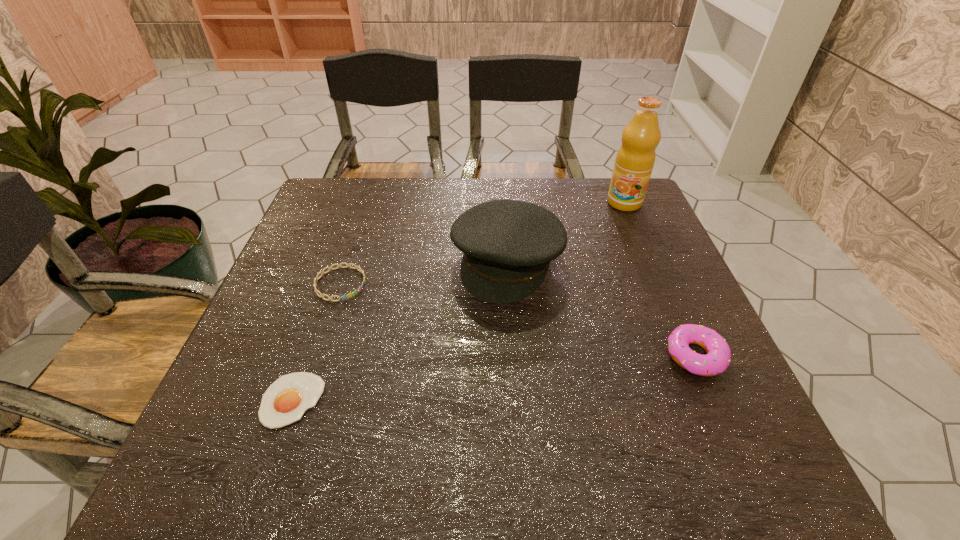
This screenshot has width=960, height=540. In order to click on vacant space at the far right corner of the desktop in this screenshot , I will do `click(606, 217)`.

Image resolution: width=960 pixels, height=540 pixels. Find the location of `free spot between the beret and the shortest object`. free spot between the beret and the shortest object is located at coordinates (399, 331).

Locate an element on the screen. The image size is (960, 540). blank region between the shortest object and the third tallest object is located at coordinates (493, 378).

Where is `free space between the second tallest object and the shortest object`? free space between the second tallest object and the shortest object is located at coordinates (399, 331).

Where is `free spot between the third tallest object and the shortest object`? This screenshot has width=960, height=540. free spot between the third tallest object and the shortest object is located at coordinates (493, 378).

Locate an element on the screen. free area in between the fruit juice and the shortest object is located at coordinates (458, 301).

Where is `free space between the shortest object and the second shortest object`? This screenshot has height=540, width=960. free space between the shortest object and the second shortest object is located at coordinates (316, 342).

I want to click on free space between the shortest object and the tallest object, so click(458, 301).

Identify the location of empty space that is in between the egg yolk and the third object from right to left. (399, 331).

The image size is (960, 540). In order to click on free point between the bracelet and the beret in this screenshot , I will do `click(423, 273)`.